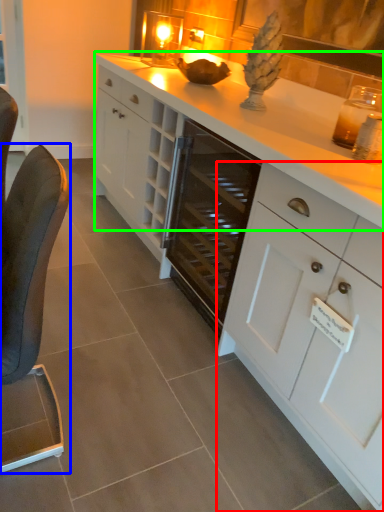
Question: Which is farther away from cabinetry (highlighted by a red box)? furniture (highlighted by a blue box) or countertop (highlighted by a green box)?

Choices:
 (A) furniture
 (B) countertop

Answer: (A)